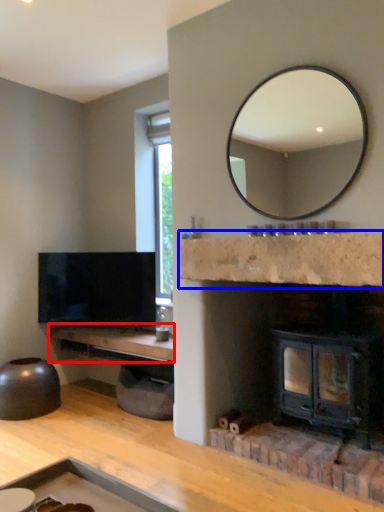
Question: Which of the following is the farthest to the observer, counter top (highlighted by a red box) or counter top (highlighted by a blue box)?

Choices:
 (A) counter top
 (B) counter top

Answer: (A)